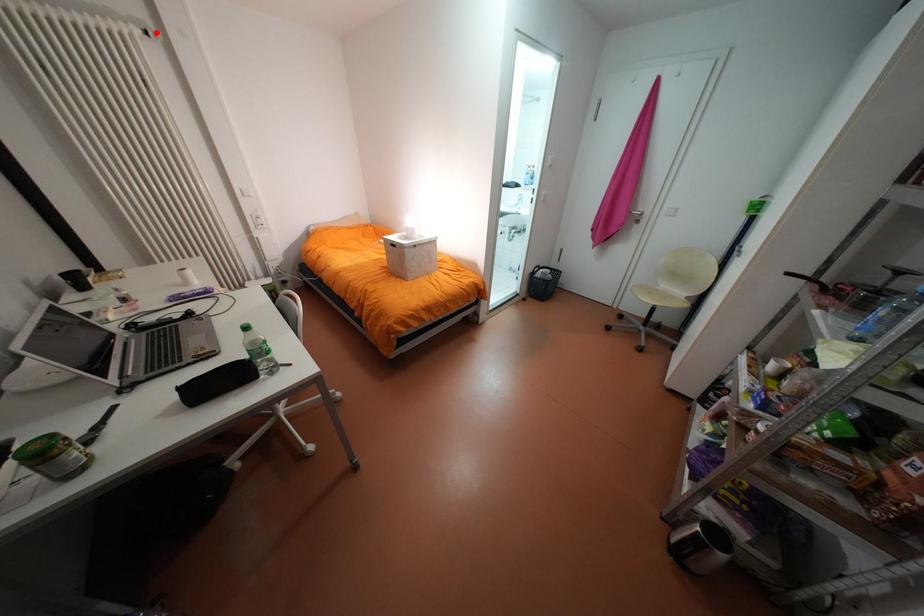
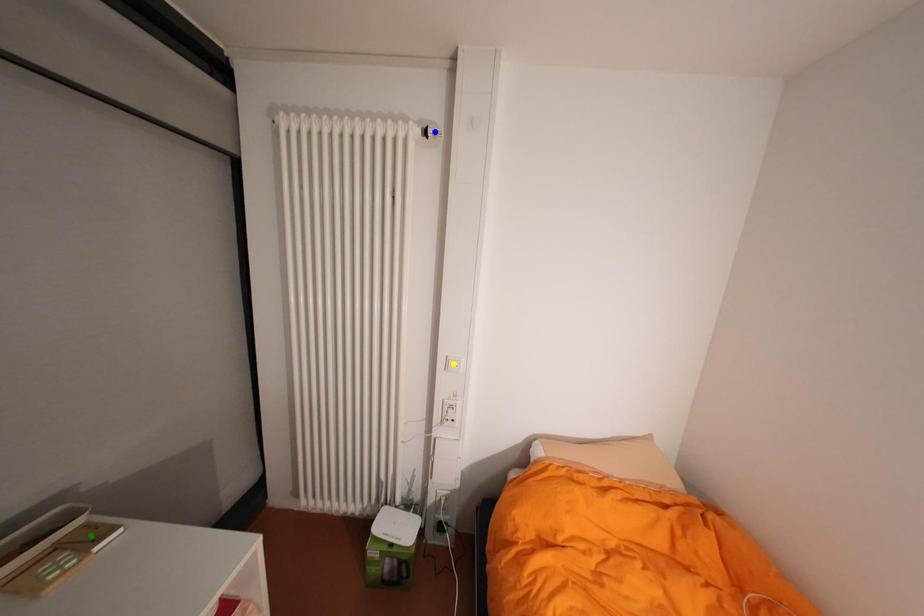
Question: I am providing you with two images of the same scene from different viewpoints. A red point is marked on the first image. You are given multiple points on the second image. Which point in image 2 is actually the same real-world point as the red point in image 1?

Choices:
 (A) green point
 (B) blue point
 (C) yellow point

Answer: (B)